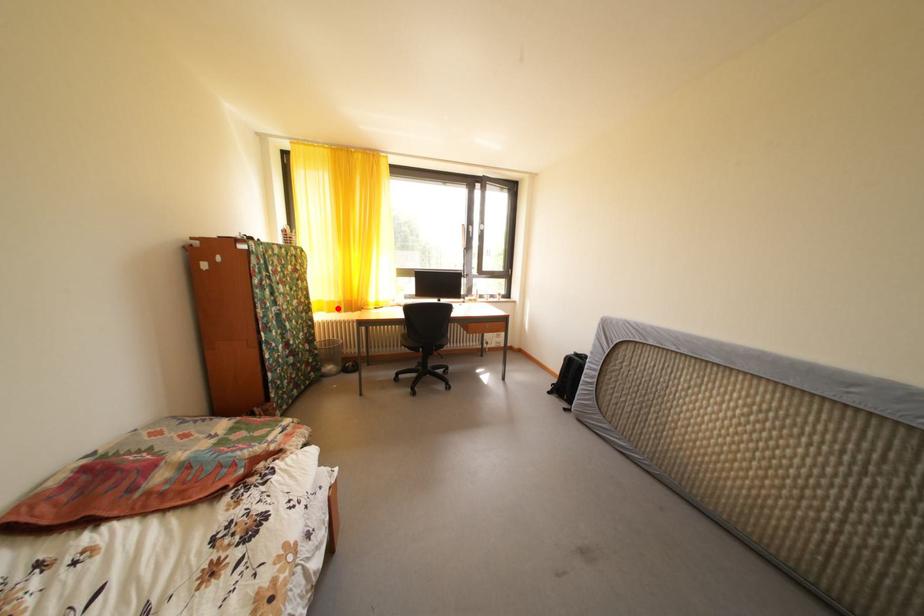
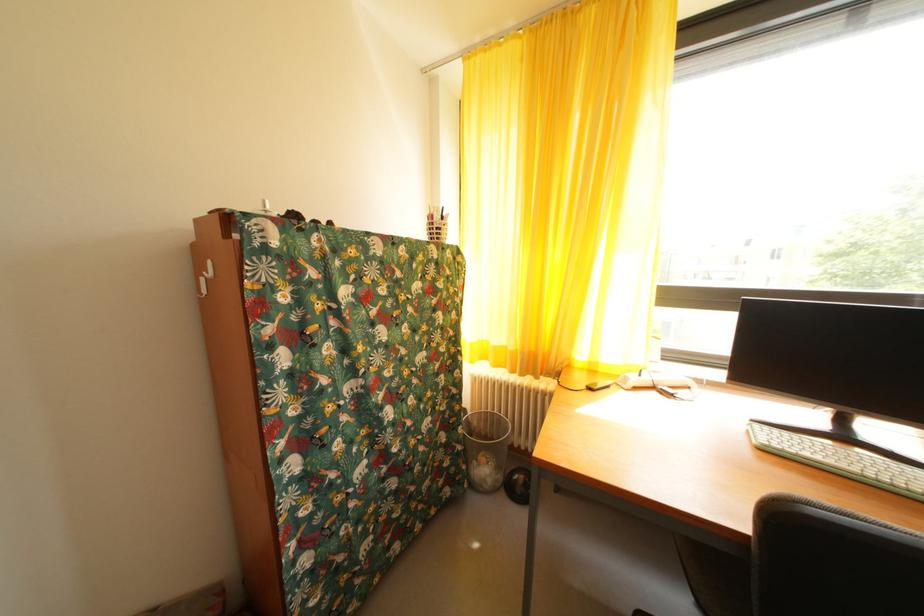
Find the pixel in the second image that matches the highlighted location in the first image.

(505, 354)